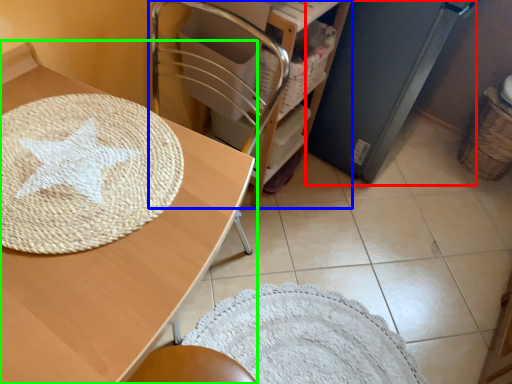
Question: Which is farther away from appliance (highlighted by a red box)? furniture (highlighted by a blue box) or table (highlighted by a green box)?

Choices:
 (A) furniture
 (B) table

Answer: (B)